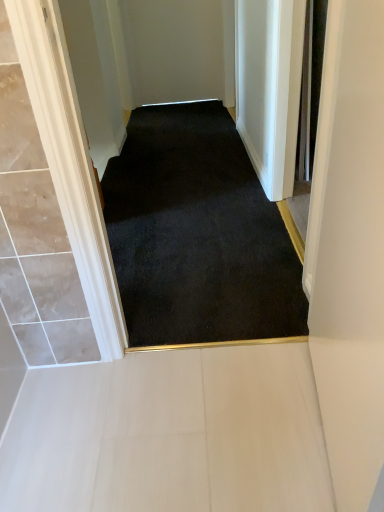
Question: Can you confirm if white tile floor at lower center is wider than black carpet at center?

Choices:
 (A) yes
 (B) no

Answer: (B)

Question: Does white tile floor at lower center appear on the right side of black carpet at center?

Choices:
 (A) yes
 (B) no

Answer: (B)

Question: Is the surface of white tile floor at lower center in direct contact with black carpet at center?

Choices:
 (A) no
 (B) yes

Answer: (A)

Question: Considering the relative sizes of white tile floor at lower center and black carpet at center in the image provided, is white tile floor at lower center bigger than black carpet at center?

Choices:
 (A) no
 (B) yes

Answer: (A)

Question: Is white tile floor at lower center turned away from black carpet at center?

Choices:
 (A) yes
 (B) no

Answer: (B)

Question: Does white tile floor at lower center lie in front of black carpet at center?

Choices:
 (A) no
 (B) yes

Answer: (B)

Question: From the image's perspective, is white tile floor at lower center on matte white door at right?

Choices:
 (A) yes
 (B) no

Answer: (B)

Question: Does white tile floor at lower center have a larger size compared to matte white door at right?

Choices:
 (A) yes
 (B) no

Answer: (B)

Question: Can you confirm if white tile floor at lower center is positioned to the right of matte white door at right?

Choices:
 (A) no
 (B) yes

Answer: (A)

Question: From the image's perspective, would you say white tile floor at lower center is shown under matte white door at right?

Choices:
 (A) no
 (B) yes

Answer: (B)

Question: Is white tile floor at lower center positioned with its back to matte white door at right?

Choices:
 (A) yes
 (B) no

Answer: (B)

Question: Can you confirm if white tile floor at lower center is smaller than matte white door at right?

Choices:
 (A) yes
 (B) no

Answer: (A)

Question: Is matte white door at right not close to white tile floor at lower center?

Choices:
 (A) no
 (B) yes

Answer: (A)